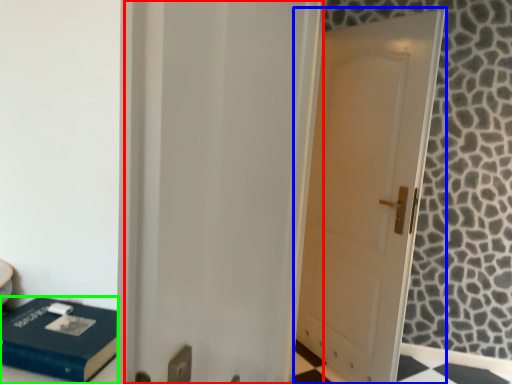
Question: Estimate the real-world distances between objects in this image. Which object is farther from screen door (highlighted by a red box), door (highlighted by a blue box) or box (highlighted by a green box)?

Choices:
 (A) door
 (B) box

Answer: (A)